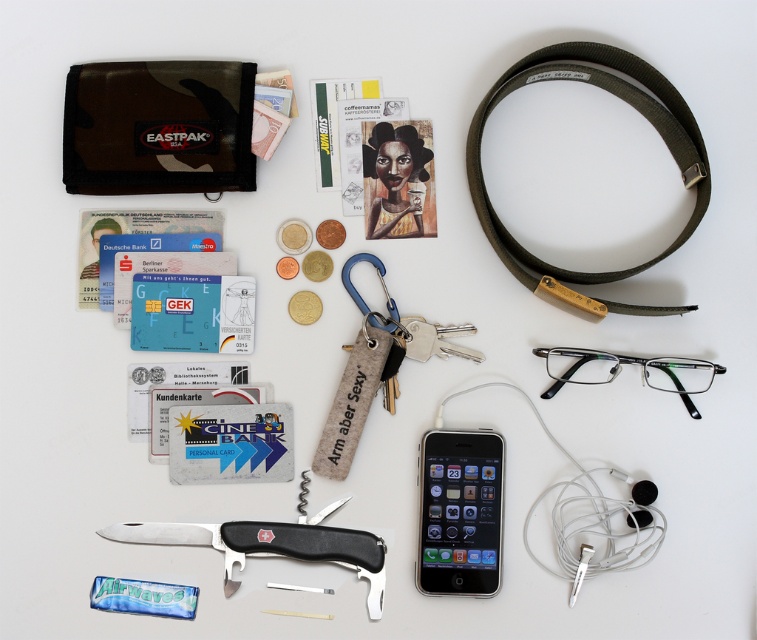
Is olive green fabric strap at upper right positioned before matte black glasses at lower right?

Yes, it is.

The image size is (757, 640). I want to click on olive green fabric strap at upper right, so click(x=621, y=99).

Can you confirm if olive green fabric strap at upper right is positioned above silver metallic smartphone at center?

Yes.

Between olive green fabric strap at upper right and silver metallic smartphone at center, which one is positioned lower?

Positioned lower is silver metallic smartphone at center.

Between point (586, 60) and point (475, 516), which one is positioned behind?

The point (586, 60) is more distant.

Image resolution: width=757 pixels, height=640 pixels. I want to click on olive green fabric strap at upper right, so click(x=621, y=99).

Measure the distance from olive green fabric strap at upper right to black plastic pocket knife at center.

The distance of olive green fabric strap at upper right from black plastic pocket knife at center is 18.11 inches.

Does point (625, 304) come closer to viewer compared to point (226, 564)?

Yes, it is.

Identify the location of olive green fabric strap at upper right. The width and height of the screenshot is (757, 640). (621, 99).